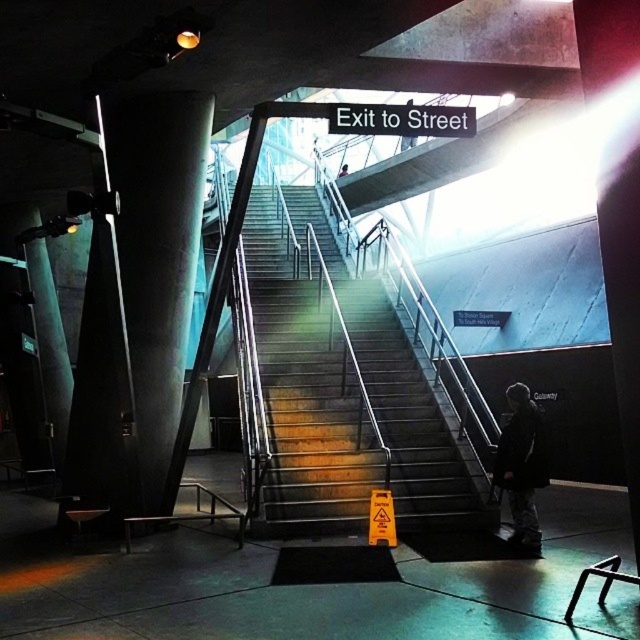
Question: Among these points, which one is nearest to the camera?

Choices:
 (A) (170, 269)
 (B) (323, 305)
 (C) (346, 166)

Answer: (A)

Question: Considering the relative positions of sleek concrete pillar at left and pink fabric person at center in the image provided, where is sleek concrete pillar at left located with respect to pink fabric person at center?

Choices:
 (A) left
 (B) right

Answer: (A)

Question: Which point is closer to the camera taking this photo?

Choices:
 (A) (529, 538)
 (B) (161, 339)

Answer: (A)

Question: Based on their relative distances, which object is nearer to the dark gray jacket at lower right?

Choices:
 (A) metallic gray stairs at center
 (B) sleek concrete pillar at left

Answer: (A)

Question: Considering the relative positions of sleek concrete pillar at left and pink fabric person at center in the image provided, where is sleek concrete pillar at left located with respect to pink fabric person at center?

Choices:
 (A) above
 (B) below

Answer: (B)

Question: Is the position of metallic gray stairs at center less distant than that of pink fabric person at center?

Choices:
 (A) yes
 (B) no

Answer: (A)